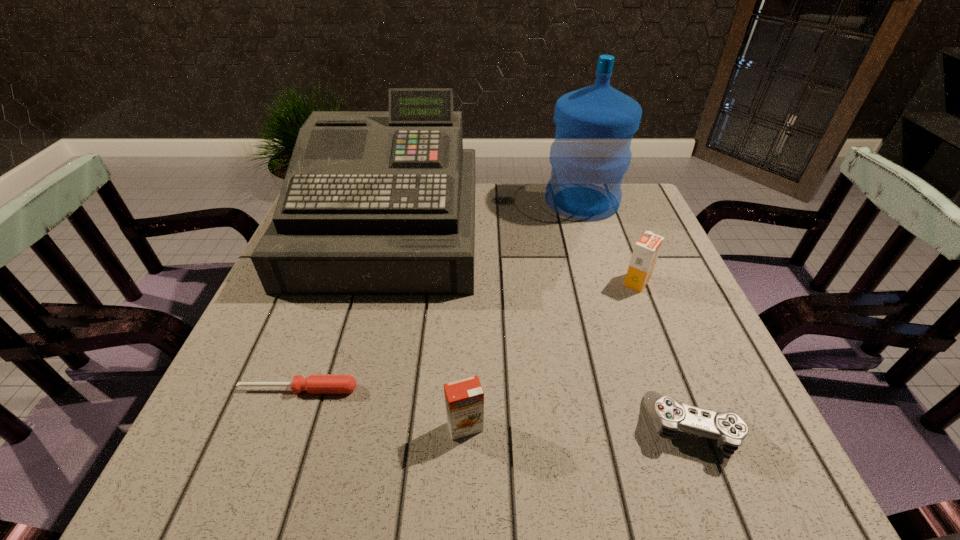
Where is `vacant region between the nearer orange juice and the right orange juice`? This screenshot has width=960, height=540. vacant region between the nearer orange juice and the right orange juice is located at coordinates (551, 354).

Locate an element on the screen. The height and width of the screenshot is (540, 960). free space that is in between the second shortest object and the farther orange juice is located at coordinates (665, 355).

Locate an element on the screen. The image size is (960, 540). free point between the water jug and the farther orange juice is located at coordinates (610, 241).

Find the location of a particular element. unoccupied area between the control and the left orange juice is located at coordinates (579, 427).

This screenshot has height=540, width=960. What are the coordinates of `empty space that is in between the screwdriver and the control` in the screenshot? It's located at (496, 408).

Locate an element on the screen. vacant area that lies between the shortest object and the farther orange juice is located at coordinates (468, 335).

Identify the location of free spot between the fifth shortest object and the control. The height and width of the screenshot is (540, 960). tap(540, 329).

Identify the location of vacant area that lies between the tallest object and the second tallest object. (485, 216).

This screenshot has width=960, height=540. Find the location of `object that stands as the fifth closest to the nearer orange juice`. object that stands as the fifth closest to the nearer orange juice is located at coordinates (591, 152).

The width and height of the screenshot is (960, 540). I want to click on object that stands as the second closest to the control, so click(464, 399).